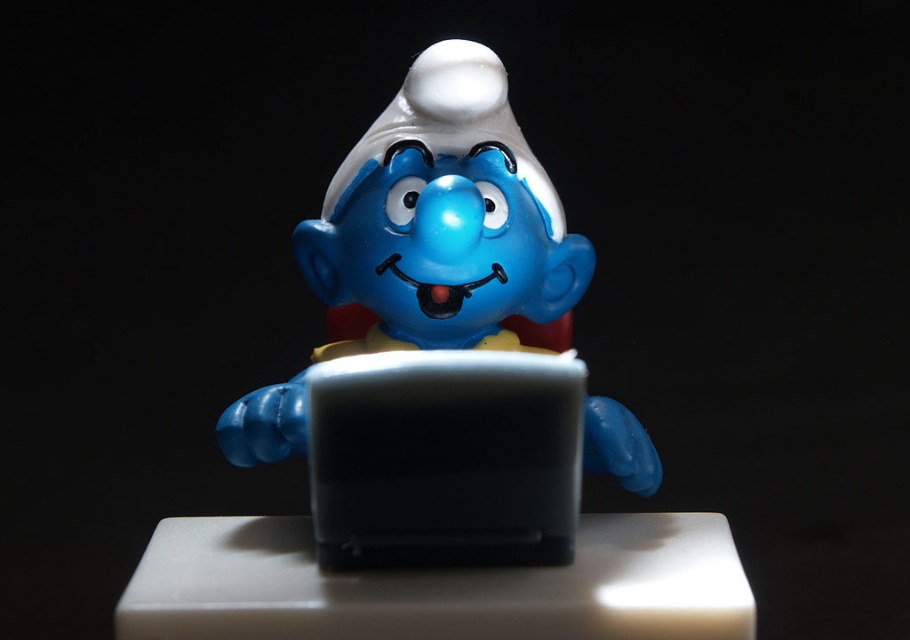
Is point (502, 74) positioned after point (415, 522)?

Yes, it is behind point (415, 522).

Which is in front, point (418, 205) or point (354, 532)?

Positioned in front is point (354, 532).

Who is more forward, (464, 141) or (311, 502)?

Point (311, 502) is more forward.

You are a GUI agent. You are given a task and a screenshot of the screen. Output one action in this format:
    pyautogui.click(x=<x>, y=<y>)
    Task: Click on the matte plastic smurf at center
    This screenshot has height=640, width=910.
    Given the screenshot: What is the action you would take?
    pyautogui.click(x=443, y=221)